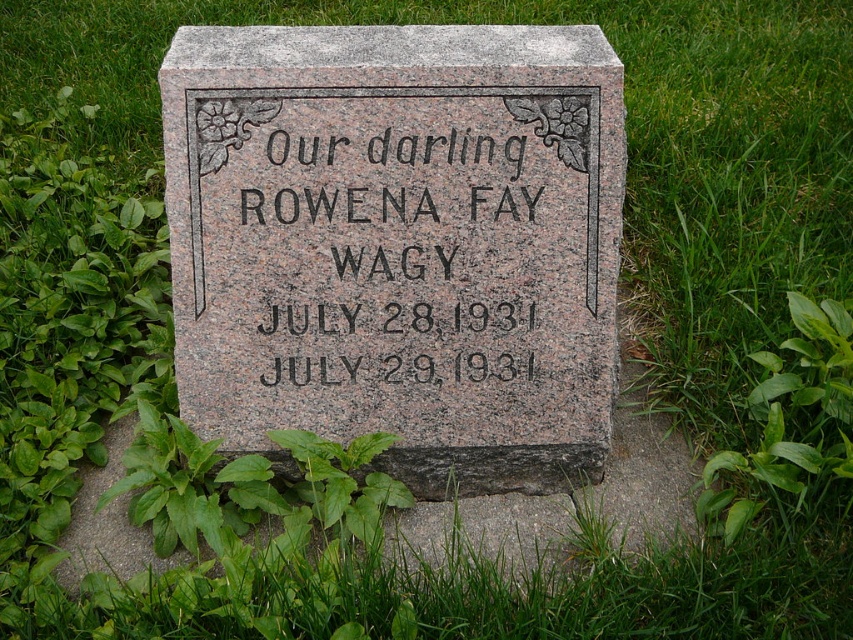
Question: Is black granite text at center below green leafy plant at lower right?

Choices:
 (A) no
 (B) yes

Answer: (A)

Question: Which point appears closest to the camera in this image?

Choices:
 (A) click(346, 417)
 (B) click(844, 356)

Answer: (A)

Question: Which is nearer to the black granite text at center?

Choices:
 (A) granite gravestone at center
 (B) green leafy plant at lower right

Answer: (A)

Question: Which is farther from the black granite text at center?

Choices:
 (A) granite gravestone at center
 (B) green leafy plant at lower right

Answer: (B)

Question: Does black granite text at center come behind green leafy plant at lower right?

Choices:
 (A) no
 (B) yes

Answer: (B)

Question: Can you confirm if granite gravestone at center is bigger than black granite text at center?

Choices:
 (A) no
 (B) yes

Answer: (B)